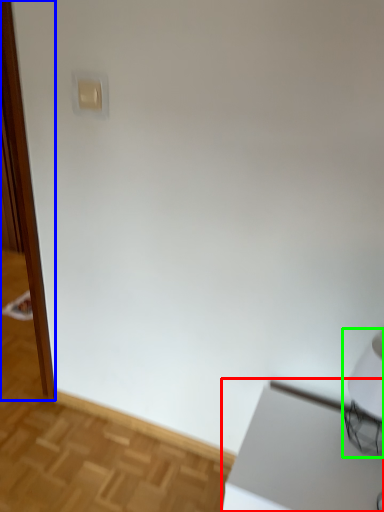
Question: Considering the real-world distances, which object is farthest from table (highlighted by a red box)? screen door (highlighted by a blue box) or table lamp (highlighted by a green box)?

Choices:
 (A) screen door
 (B) table lamp

Answer: (A)